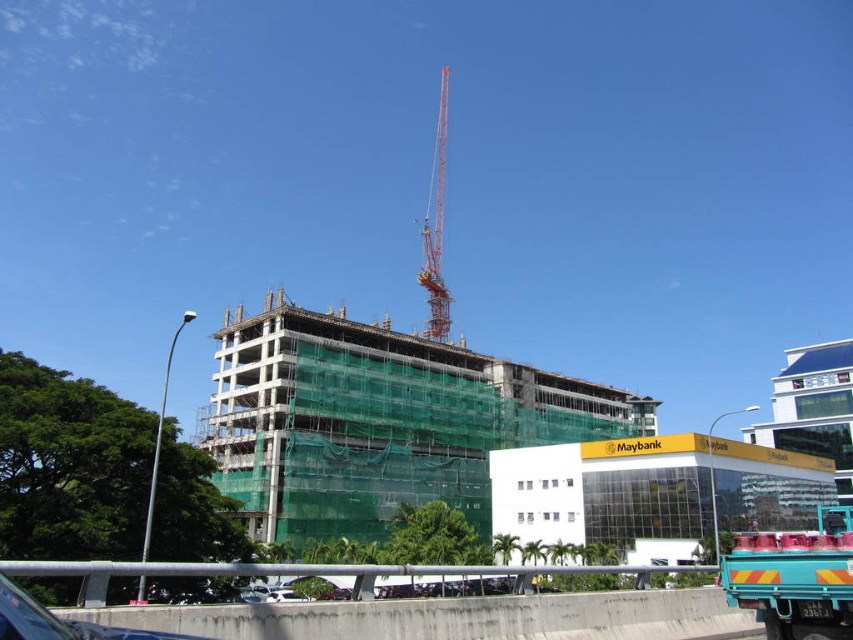
You are a delivery driver who needs to park your teal matte truck at lower right near the orange metallic crane at upper center. Given that the crane is taller than your truck, will you have enough vertical clearance to drive under it?

The teal matte truck at lower right is smaller than the orange metallic crane at upper center, so yes, you can drive under the orange metallic crane at upper center because the crane is taller and provides sufficient vertical clearance.

You are a delivery driver who needs to back up your teal matte truck at lower right into a loading area behind the orange metallic crane at upper center. Can you safely do so without hitting the crane?

The teal matte truck at lower right is not as tall as the orange metallic crane at upper center, so it should be safe to back up the teal matte truck at lower right into the loading area behind the orange metallic crane at upper center without hitting it.